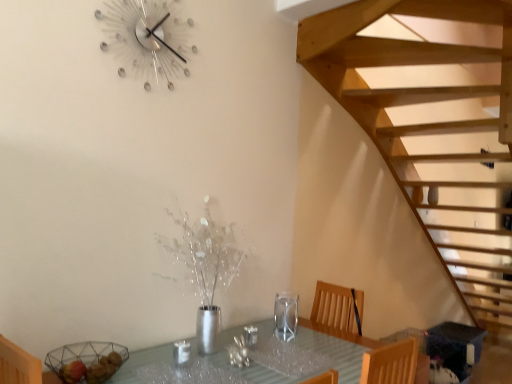
Where is `unoccupied region to the right of transparent glass wine glass at center`? unoccupied region to the right of transparent glass wine glass at center is located at coordinates (319, 331).